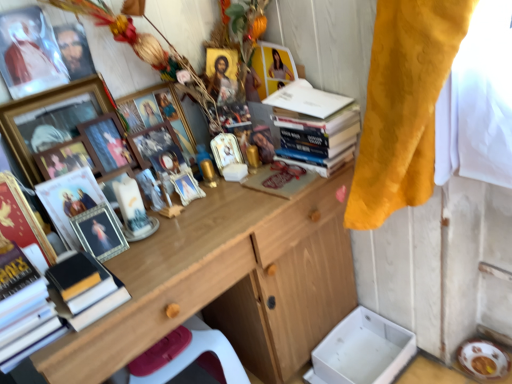
Find the location of `free space above matte brown book at center, arranged as the first magazine when viewed from the right (from a real-world perspective)`. free space above matte brown book at center, arranged as the first magazine when viewed from the right (from a real-world perspective) is located at coordinates (282, 179).